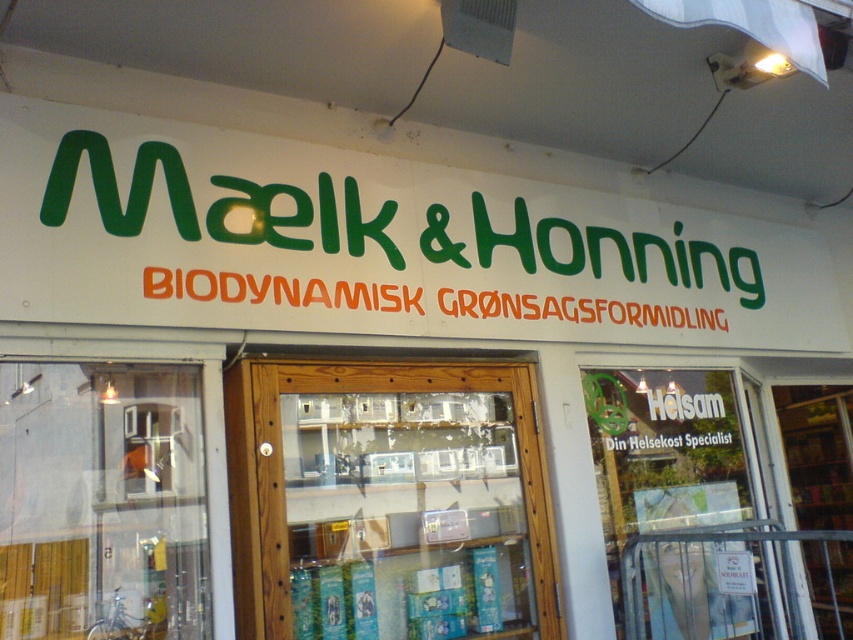
Question: Does wooden door at center appear under transparent glass door at center?

Choices:
 (A) yes
 (B) no

Answer: (B)

Question: Which of the following is the farthest from the observer?

Choices:
 (A) transparent glass door at center
 (B) wooden door at center
 (C) transparent glass door at lower left

Answer: (A)

Question: Can you confirm if wooden door at center is wider than transparent glass door at center?

Choices:
 (A) no
 (B) yes

Answer: (B)

Question: Which is nearer to the wooden door at center?

Choices:
 (A) transparent glass door at lower left
 (B) transparent glass door at center

Answer: (A)

Question: Which object is the farthest from the transparent glass door at lower left?

Choices:
 (A) transparent glass door at center
 (B) wooden door at center

Answer: (A)

Question: Does transparent glass door at lower left come behind transparent glass door at center?

Choices:
 (A) yes
 (B) no

Answer: (B)